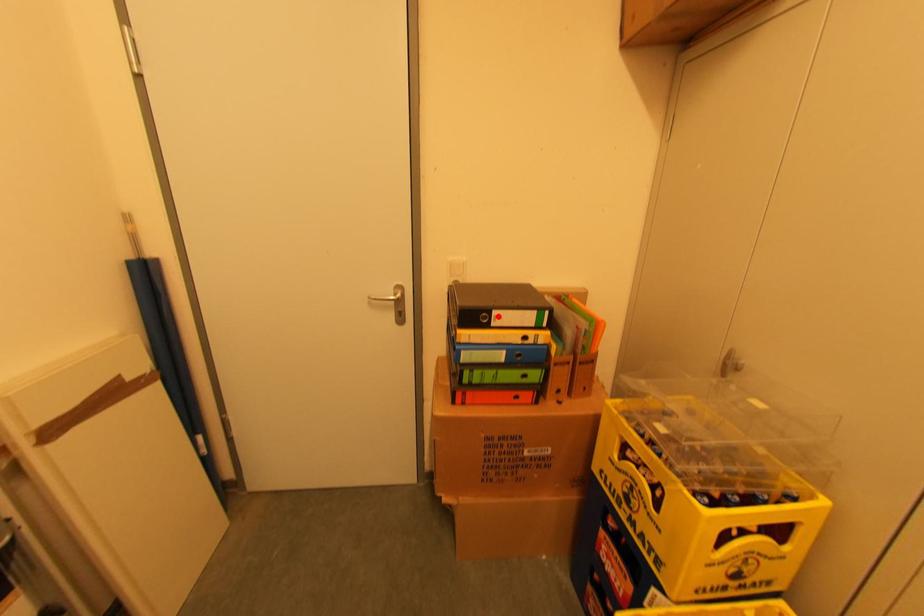
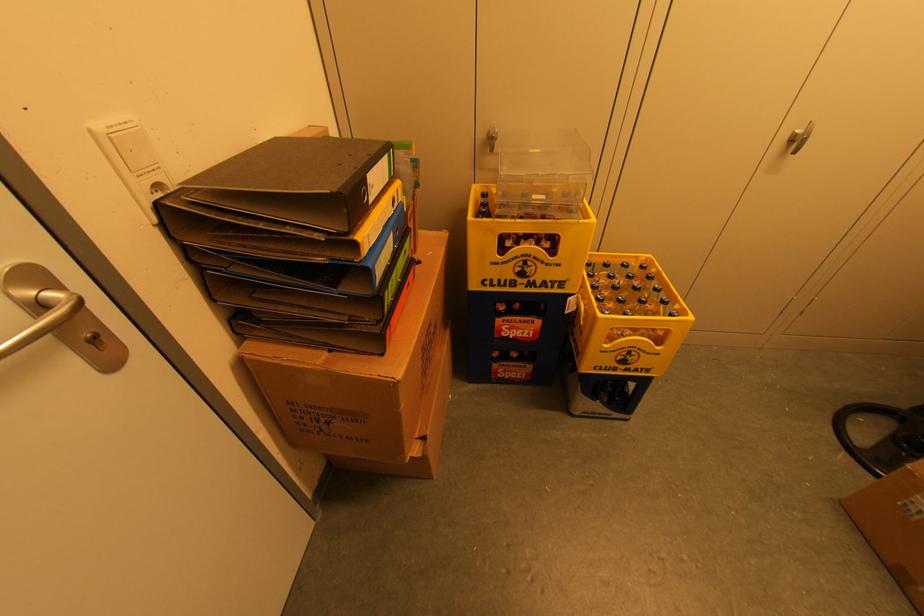
Question: I am providing you with two images of the same scene from different viewpoints. Given a red point in image1, look at the same physical point in image2. Is it:

Choices:
 (A) Closer to the viewpoint
 (B) Farther from the viewpoint

Answer: (A)